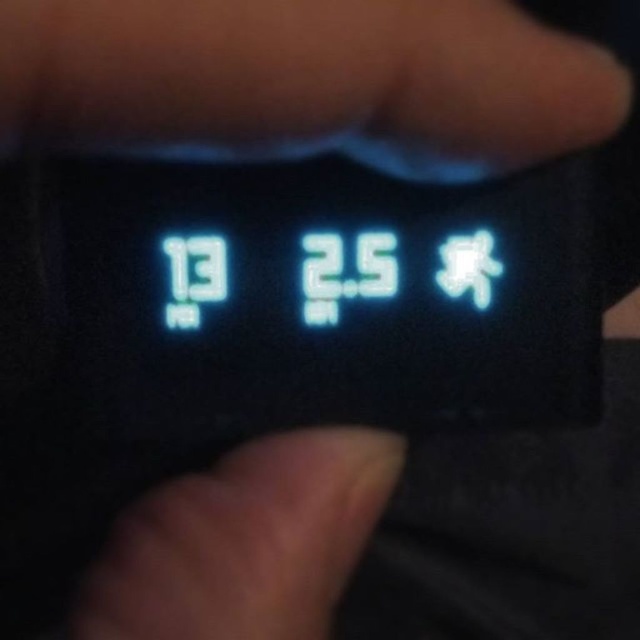
Based on the photo, you are a photographer adjusting the settings on your camera. You notice two parts of your hand in the frame. The black matte hand at upper center and the smooth skin at center. Which part of your hand appears bigger in the photo?

The black matte hand at upper center appears bigger in the photo because it has a larger size compared to the smooth skin at center.

You are a photographer adjusting the settings on your camera. You notice two parts of your hand visible in the image. Which part of your hand is wider between the black matte hand at upper center and the smooth skin at center?

The black matte hand at upper center is wider than the smooth skin at center.

You are adjusting the settings on a camera displayed on a digital screen. The screen shows the current aperture setting as f13 and shutter speed as 1 over 2.5 seconds. Your task is to move your hand to the exact center of the screen to confirm the settings. Is the black matte hand at upper center positioned correctly to confirm the settings?

The black matte hand at upper center is located at point (x=307, y=72), which may not be the exact center of the screen. To confirm the settings, the hand needs to be at the center coordinates, so the current position might not be correct.